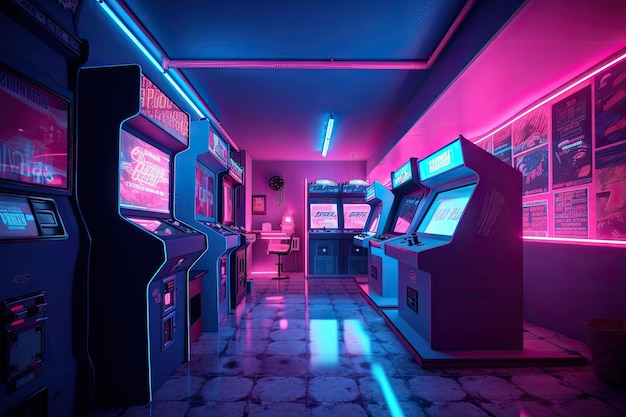
What are the coordinates of `work desk` in the screenshot? It's located at (279, 236).